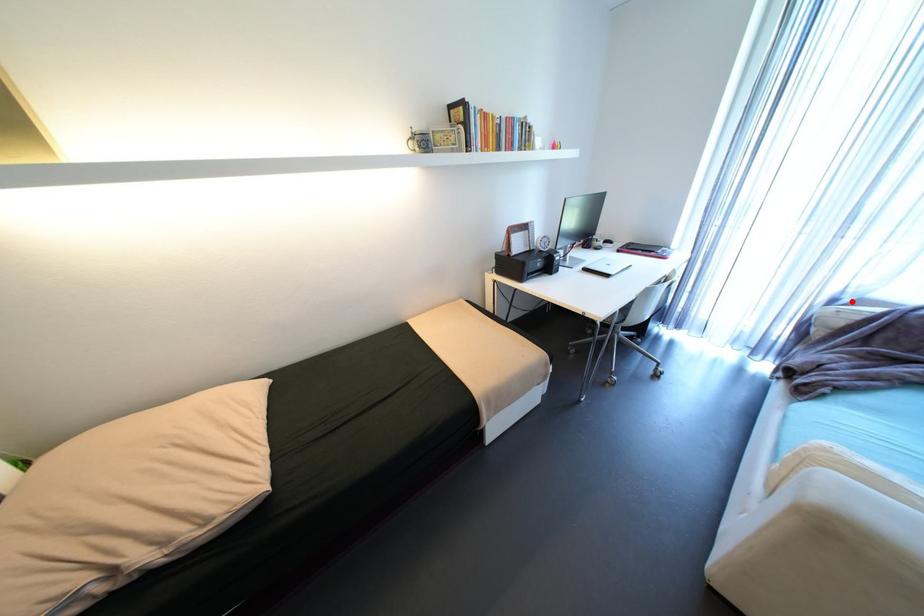
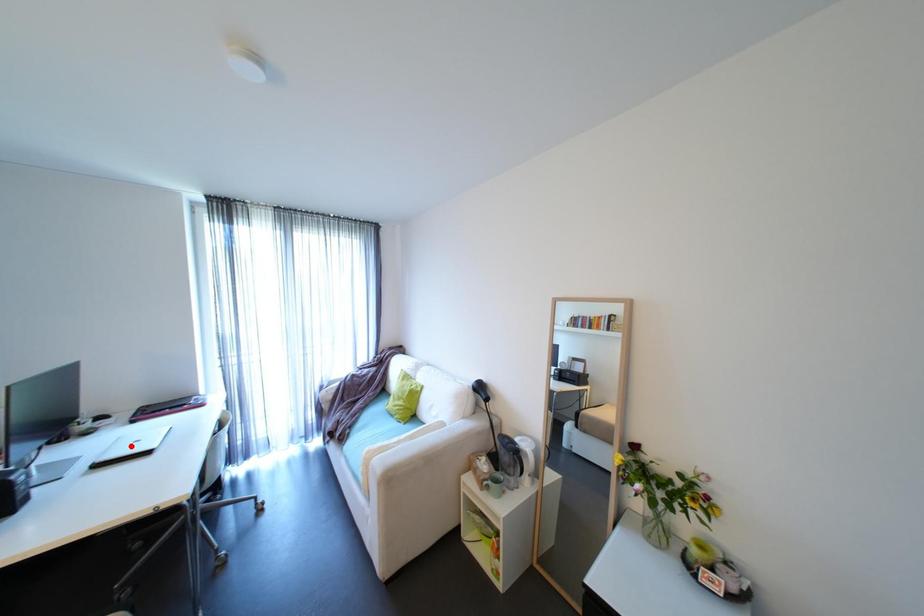
I am providing you with two images of the same scene from different viewpoints. A red point is marked on the first image and another point is marked on the second image. Is the marked point in image1 the same physical position as the marked point in image2?

No